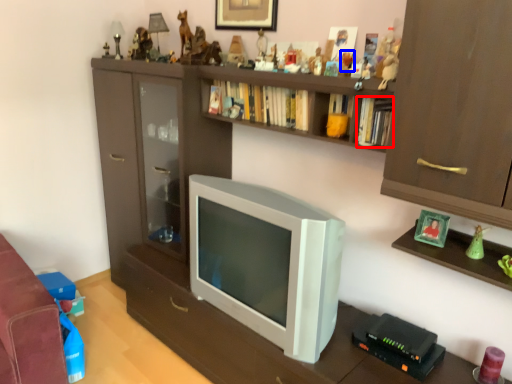
Question: Which object is further to the camera taking this photo, book (highlighted by a red box) or toy (highlighted by a blue box)?

Choices:
 (A) book
 (B) toy

Answer: (B)